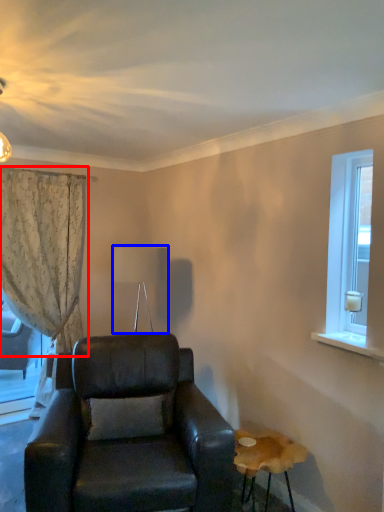
Question: Which object appears farthest to the camera in this image, curtain (highlighted by a red box) or lamp (highlighted by a blue box)?

Choices:
 (A) curtain
 (B) lamp

Answer: (A)